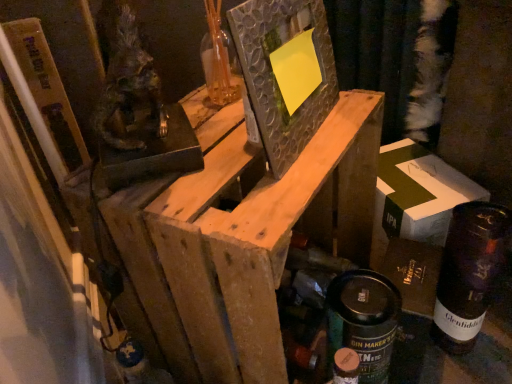
The height and width of the screenshot is (384, 512). In order to click on vacant region to the left of textured glass picture frame at center in this screenshot , I will do `click(201, 156)`.